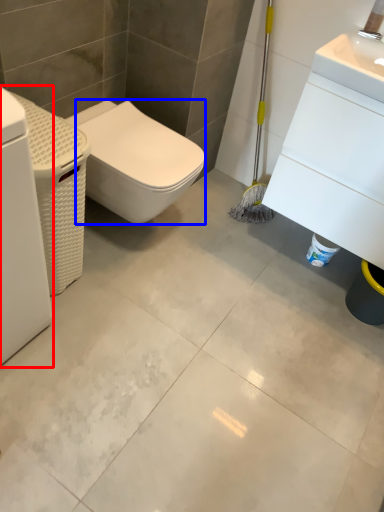
Question: Among these objects, which one is nearest to the camera, washing machine (highlighted by a red box) or bidet (highlighted by a blue box)?

Choices:
 (A) washing machine
 (B) bidet

Answer: (A)